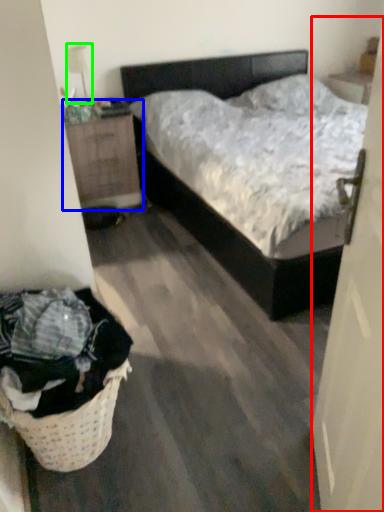
Question: Estimate the real-world distances between objects in this image. Which object is farther from door (highlighted by a red box), nightstand (highlighted by a blue box) or lamp (highlighted by a green box)?

Choices:
 (A) nightstand
 (B) lamp

Answer: (B)